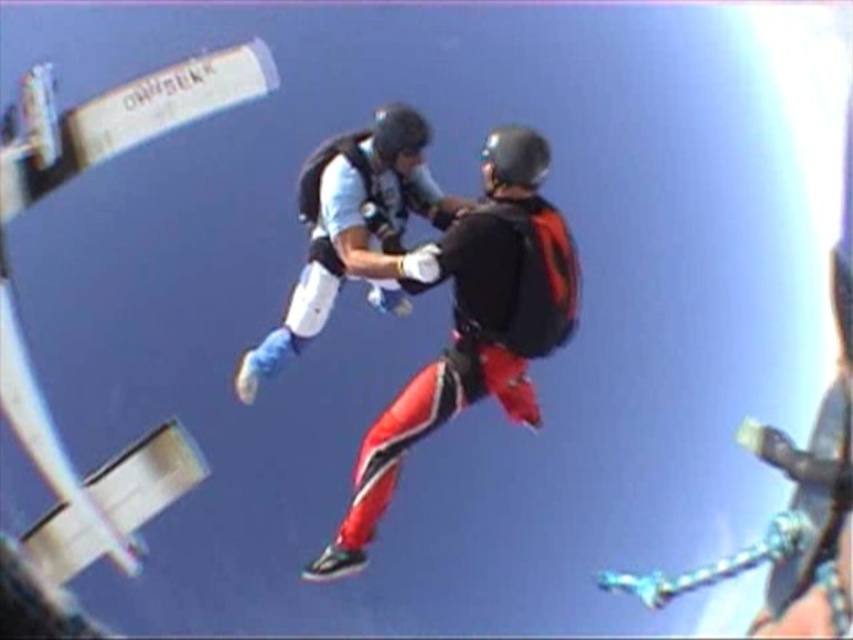
Question: Among these objects, which one is nearest to the camera?

Choices:
 (A) matte white suit at center
 (B) red and black ski suit at center

Answer: (B)

Question: Which point is farther to the camera?

Choices:
 (A) click(x=483, y=234)
 (B) click(x=350, y=234)

Answer: (B)

Question: Is red and black ski suit at center in front of matte white suit at center?

Choices:
 (A) yes
 (B) no

Answer: (A)

Question: Can you confirm if red and black ski suit at center is wider than matte white suit at center?

Choices:
 (A) yes
 (B) no

Answer: (A)

Question: Is red and black ski suit at center above matte white suit at center?

Choices:
 (A) no
 (B) yes

Answer: (A)